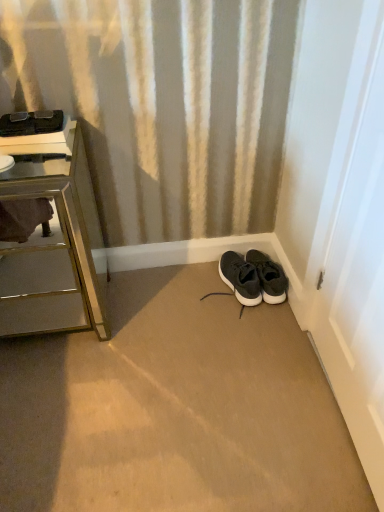
Question: Considering the relative positions of metallic mirrored chest of drawers at left and black matte sneakers at lower right in the image provided, is metallic mirrored chest of drawers at left to the left of black matte sneakers at lower right from the viewer's perspective?

Choices:
 (A) yes
 (B) no

Answer: (A)

Question: Does metallic mirrored chest of drawers at left lie in front of black matte sneakers at lower right?

Choices:
 (A) no
 (B) yes

Answer: (B)

Question: Can we say metallic mirrored chest of drawers at left lies outside black matte sneakers at lower right?

Choices:
 (A) yes
 (B) no

Answer: (A)

Question: Can you confirm if metallic mirrored chest of drawers at left is smaller than black matte sneakers at lower right?

Choices:
 (A) no
 (B) yes

Answer: (A)

Question: Is metallic mirrored chest of drawers at left positioned with its back to black matte sneakers at lower right?

Choices:
 (A) no
 (B) yes

Answer: (A)

Question: Are metallic mirrored chest of drawers at left and black matte sneakers at lower right making contact?

Choices:
 (A) yes
 (B) no

Answer: (B)

Question: Considering the relative sizes of matte black sneaker at lower right and metallic mirrored chest of drawers at left in the image provided, is matte black sneaker at lower right wider than metallic mirrored chest of drawers at left?

Choices:
 (A) yes
 (B) no

Answer: (B)

Question: From a real-world perspective, is matte black sneaker at lower right under metallic mirrored chest of drawers at left?

Choices:
 (A) no
 (B) yes

Answer: (B)

Question: Can you confirm if matte black sneaker at lower right is bigger than metallic mirrored chest of drawers at left?

Choices:
 (A) yes
 (B) no

Answer: (B)

Question: Considering the relative sizes of matte black sneaker at lower right and metallic mirrored chest of drawers at left in the image provided, is matte black sneaker at lower right shorter than metallic mirrored chest of drawers at left?

Choices:
 (A) yes
 (B) no

Answer: (A)

Question: Is matte black sneaker at lower right not close to metallic mirrored chest of drawers at left?

Choices:
 (A) no
 (B) yes

Answer: (A)

Question: Can you confirm if matte black sneaker at lower right is taller than metallic mirrored chest of drawers at left?

Choices:
 (A) yes
 (B) no

Answer: (B)

Question: From a real-world perspective, is metallic mirrored chest of drawers at left under matte black sneaker at lower right?

Choices:
 (A) yes
 (B) no

Answer: (B)